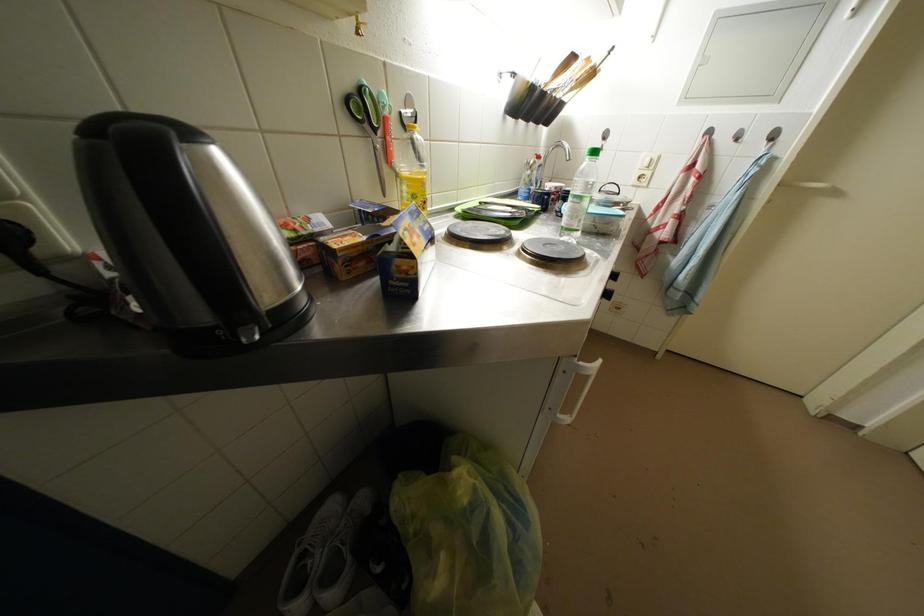
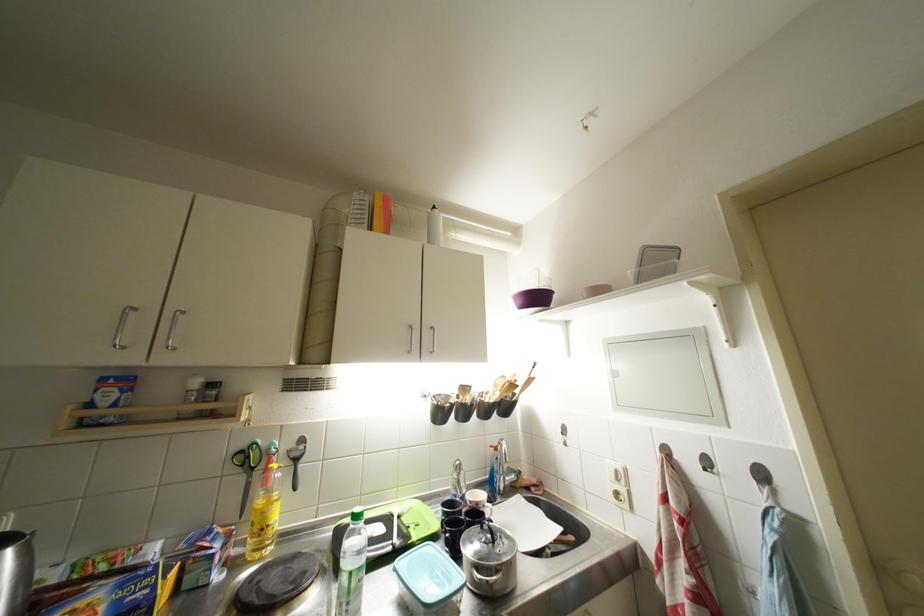
Locate, in the second image, the point that corresponds to point 430,188 in the first image.

(271, 517)